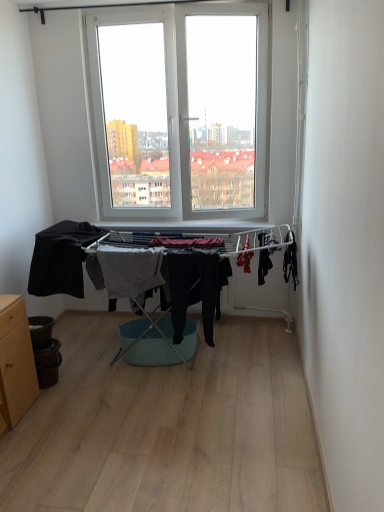
Question: Would you say black matte fabric at left, acting as the 1th clothing starting from the left, is part of gray cotton towel at center, which is counted as the second clothing, starting from the left,'s contents?

Choices:
 (A) no
 (B) yes

Answer: (A)

Question: Considering the relative sizes of gray cotton towel at center, which appears as the third clothing when viewed from the right, and black matte fabric at left, the 4th clothing when ordered from right to left, in the image provided, is gray cotton towel at center, which appears as the third clothing when viewed from the right, shorter than black matte fabric at left, the 4th clothing when ordered from right to left,?

Choices:
 (A) yes
 (B) no

Answer: (B)

Question: From a real-world perspective, does gray cotton towel at center, which is counted as the second clothing, starting from the left, stand above black matte fabric at left, acting as the 1th clothing starting from the left?

Choices:
 (A) yes
 (B) no

Answer: (B)

Question: Is gray cotton towel at center, which appears as the third clothing when viewed from the right, to the left of black matte fabric at left, the 4th clothing when ordered from right to left, from the viewer's perspective?

Choices:
 (A) yes
 (B) no

Answer: (B)

Question: Is gray cotton towel at center, which appears as the third clothing when viewed from the right, taller than black matte fabric at left, the 4th clothing when ordered from right to left?

Choices:
 (A) yes
 (B) no

Answer: (A)

Question: Considering the relative sizes of black matte fabric at left, the 4th clothing when ordered from right to left, and gray cotton towel at center, which appears as the third clothing when viewed from the right, in the image provided, is black matte fabric at left, the 4th clothing when ordered from right to left, smaller than gray cotton towel at center, which appears as the third clothing when viewed from the right,?

Choices:
 (A) no
 (B) yes

Answer: (A)

Question: Does black matte fabric at left, the 4th clothing when ordered from right to left, lie behind gray cotton towel at center, which is counted as the second clothing, starting from the left?

Choices:
 (A) yes
 (B) no

Answer: (A)

Question: Is black matte fabric at left, acting as the 1th clothing starting from the left, next to gray cotton towel at center, which appears as the third clothing when viewed from the right?

Choices:
 (A) no
 (B) yes

Answer: (A)

Question: Is black matte fabric at left, the 4th clothing when ordered from right to left, not near gray cotton towel at center, which is counted as the second clothing, starting from the left?

Choices:
 (A) yes
 (B) no

Answer: (B)

Question: Can you confirm if black matte fabric at left, acting as the 1th clothing starting from the left, is thinner than gray cotton towel at center, which is counted as the second clothing, starting from the left?

Choices:
 (A) yes
 (B) no

Answer: (B)

Question: From the image's perspective, is black matte fabric at left, the 4th clothing when ordered from right to left, located beneath gray cotton towel at center, which appears as the third clothing when viewed from the right?

Choices:
 (A) no
 (B) yes

Answer: (A)

Question: Is wooden cabinet at lower left inside black matte fabric at left, the 4th clothing when ordered from right to left?

Choices:
 (A) no
 (B) yes

Answer: (A)